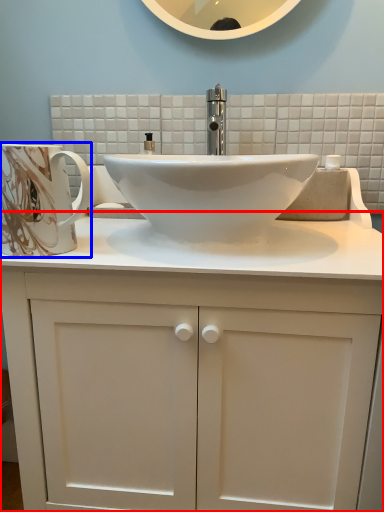
Question: Which object appears closest to the camera in this image, bathroom cabinet (highlighted by a red box) or mug (highlighted by a blue box)?

Choices:
 (A) bathroom cabinet
 (B) mug

Answer: (A)